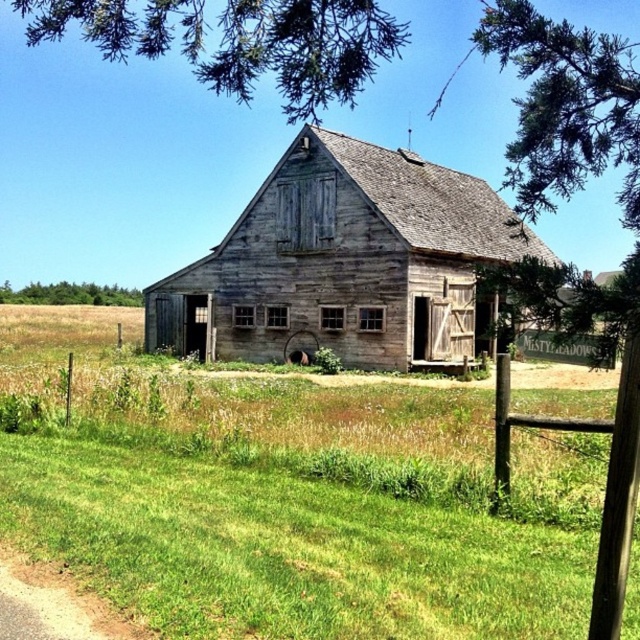
You are standing in front of the barn and notice the green grass at center and the green leafy tree at upper center. Which object is located to the right of the other?

The green grass at center is positioned on the right side of green leafy tree at upper center.

You are standing in front of the rustic wooden barn and notice a point marked at coordinates (116, 161). Based on the scene description, what object is located at this point?

The point at 0.254, 0.184 marks the green leafy tree at upper center.

Consider the image. You are standing in front of the barn and see two points marked on the ground. The first point is at coordinates point (42, 179) and the second point is at point (35, 285). Which point is closer to you?

Point (42, 179) is in front of point (35, 285), so it is closer to you.